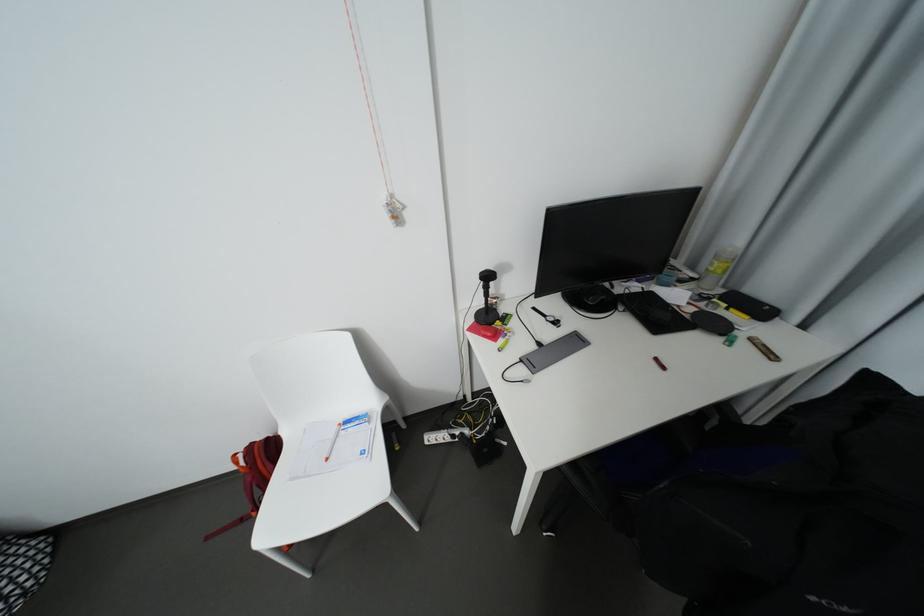
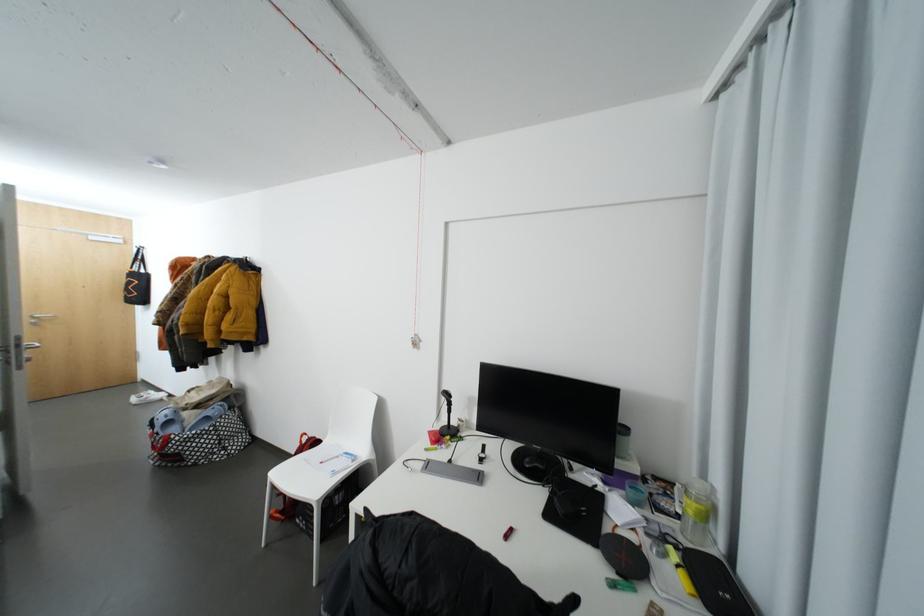
Locate, in the second image, the point that corresponds to [478,321] in the first image.

(444, 428)